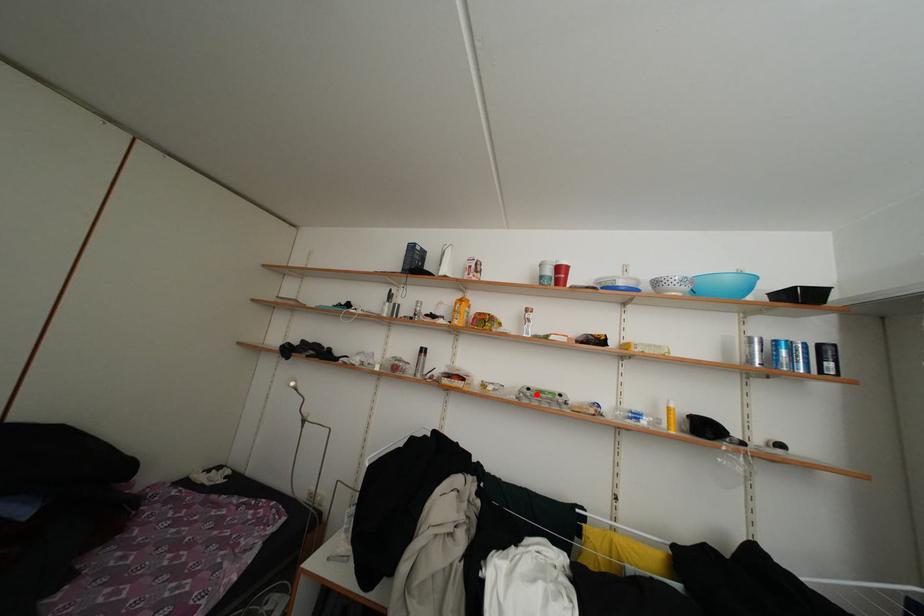
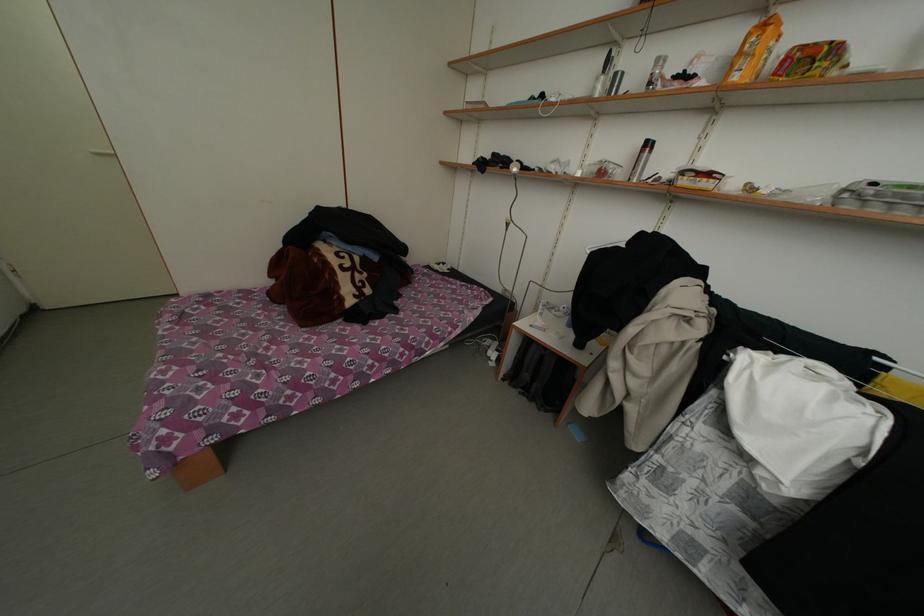
The point at the highlighted location is marked in the first image. Where is the corresponding point in the second image?

(881, 188)